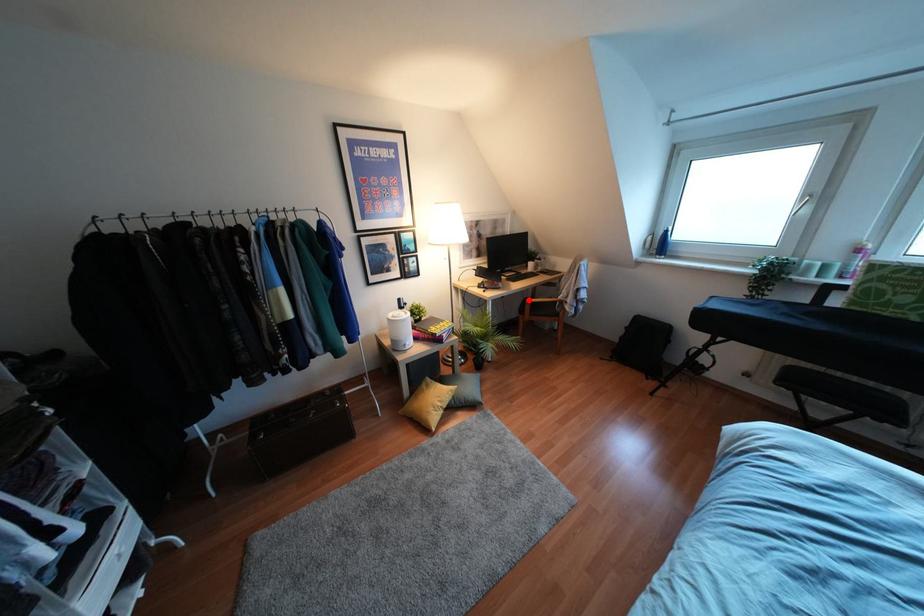
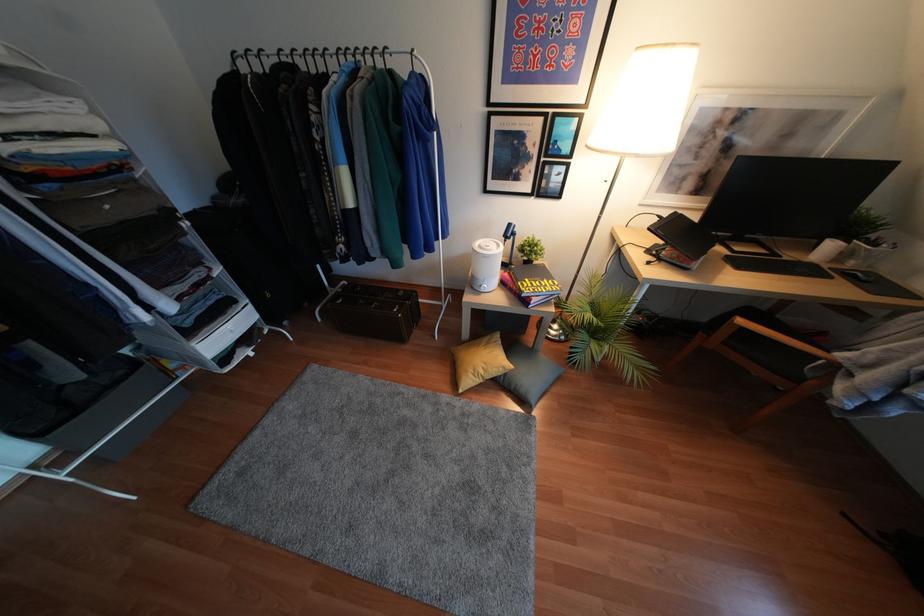
Find the pixel in the second image that matches the highlighted location in the first image.

(739, 321)